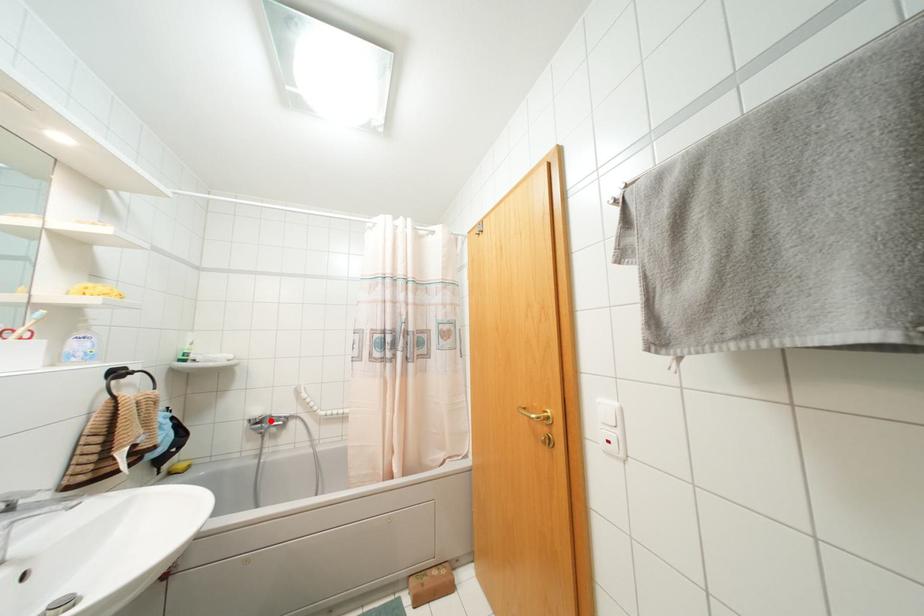
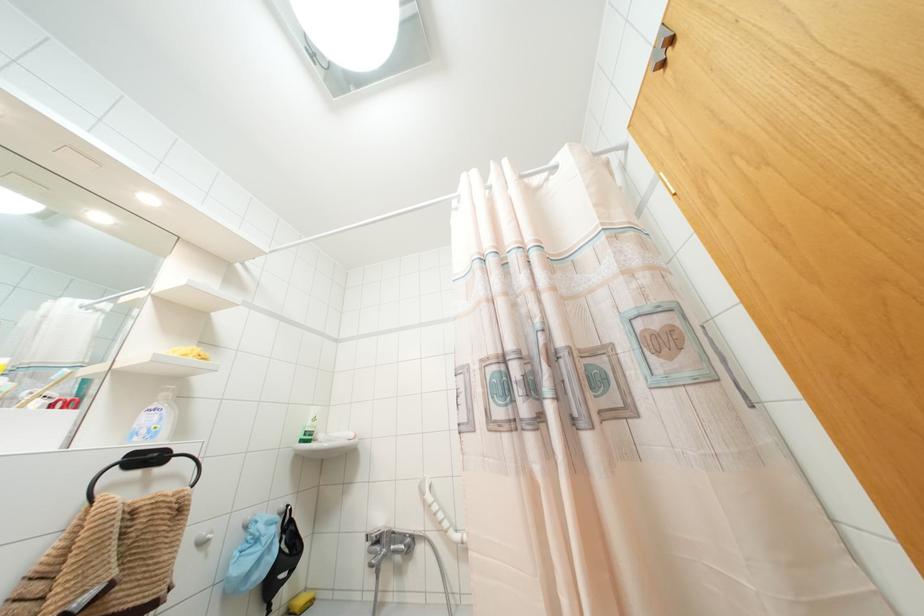
Locate, in the second image, the point that corresponds to the highlighted location in the first image.

(390, 541)